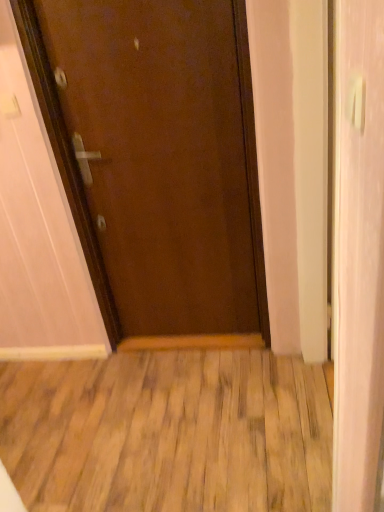
Question: From a real-world perspective, is brown matte door at center above or below wooden floor at center?

Choices:
 (A) above
 (B) below

Answer: (A)

Question: Relative to wooden floor at center, is brown matte door at center in front or behind?

Choices:
 (A) behind
 (B) front

Answer: (A)

Question: Which object is the closest to the brown matte door at center?

Choices:
 (A) white glossy door at right
 (B) wooden floor at center
 (C) white plastic door handle at upper right

Answer: (B)

Question: Based on their relative distances, which object is farther from the white plastic door handle at upper right?

Choices:
 (A) brown matte door at center
 (B) wooden floor at center
 (C) white glossy door at right

Answer: (B)